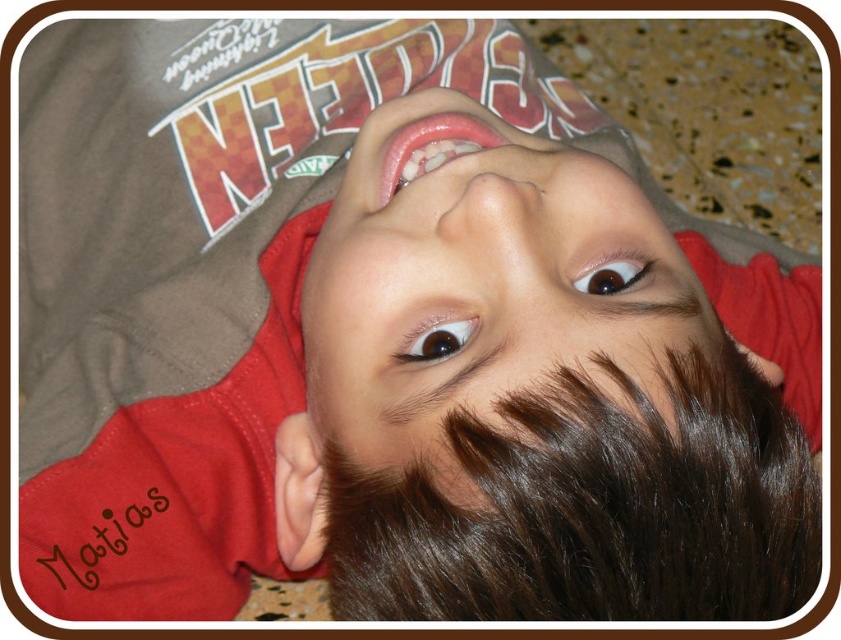
The scene shows a boy lying down with his face looking up. You need to determine the position of the smooth skin face at center relative to the brown glossy eye at center. Which object is positioned higher?

The smooth skin face at center is located above the brown glossy eye at center, so the smooth skin face at center is higher.

You are taking a photo of the boy and want to focus on his face and eyes. Since the smooth skin face at center and the brown glossy eye at center are positioned in a certain way, which one should you adjust your camera to focus on first to ensure both are in frame?

The smooth skin face at center is to the right of the brown glossy eye at center, so you should focus on the brown glossy eye at center first to ensure both are in frame as you adjust the camera.

What is the exact coordinate of the smooth skin face at center?

The smooth skin face at center is located at point (x=477, y=291).